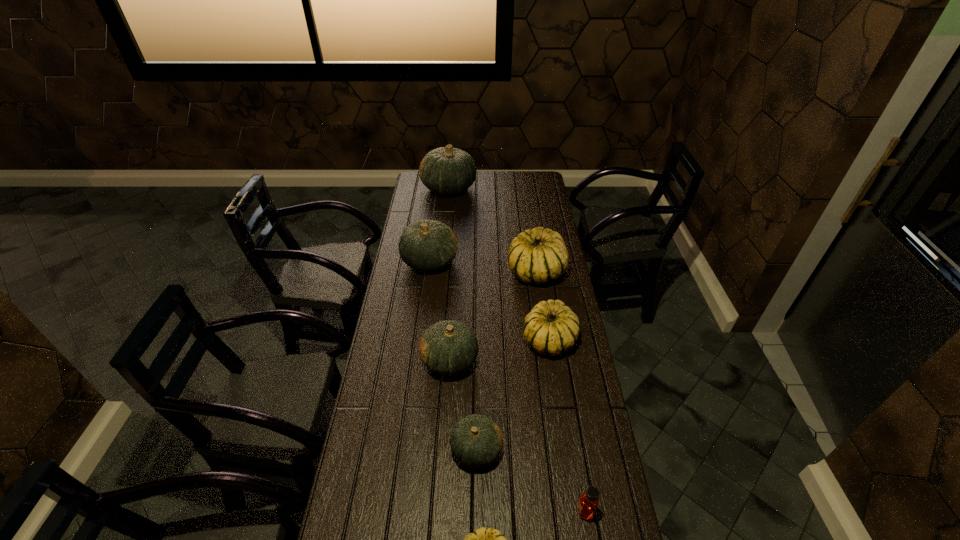
This screenshot has height=540, width=960. I want to click on object that is positioned at the far left corner, so click(446, 170).

This screenshot has height=540, width=960. I want to click on vacant space at the far edge of the desktop, so click(x=507, y=190).

Identify the location of free space at the left edge of the desktop. The height and width of the screenshot is (540, 960). (403, 316).

You are a GUI agent. You are given a task and a screenshot of the screen. Output one action in this format:
    pyautogui.click(x=<x>, y=<y>)
    Task: Click on the vacant area at the right edge
    The image size is (960, 540).
    Given the screenshot: What is the action you would take?
    pyautogui.click(x=550, y=219)

Where is `free point between the farthest white gourd and the third nearest orange gourd`? free point between the farthest white gourd and the third nearest orange gourd is located at coordinates (483, 266).

Find the location of `free space between the second biggest white gourd and the honey`. free space between the second biggest white gourd and the honey is located at coordinates (567, 426).

Where is `free spot between the second biggest orange gourd and the second farthest white gourd`? free spot between the second biggest orange gourd and the second farthest white gourd is located at coordinates (490, 300).

I want to click on free point between the nearest orange gourd and the honey, so click(x=531, y=480).

This screenshot has height=540, width=960. I want to click on unoccupied area between the nearest orange gourd and the second biggest white gourd, so click(513, 394).

The image size is (960, 540). In order to click on vacant area that lies between the third farthest orange gourd and the seventh farthest object in this screenshot , I will do `click(517, 435)`.